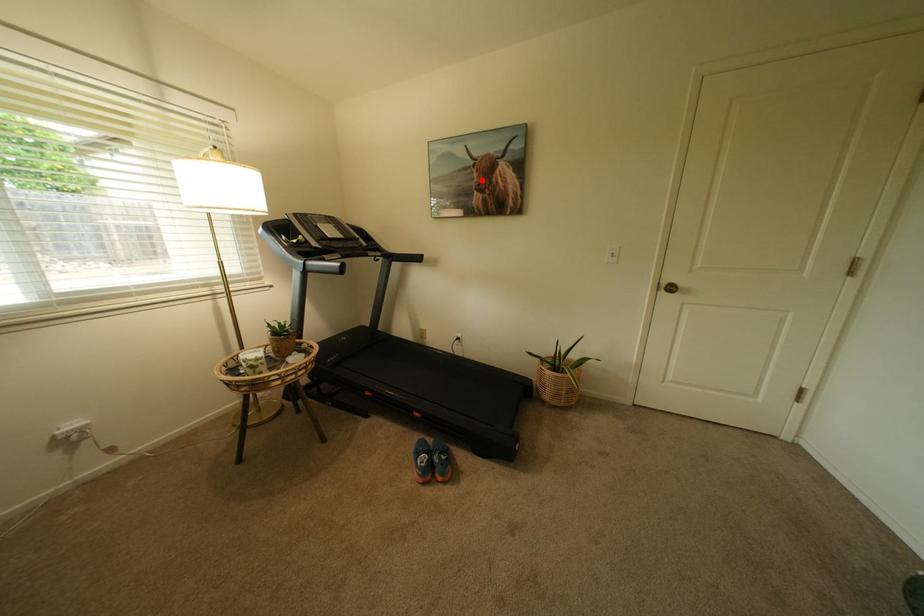
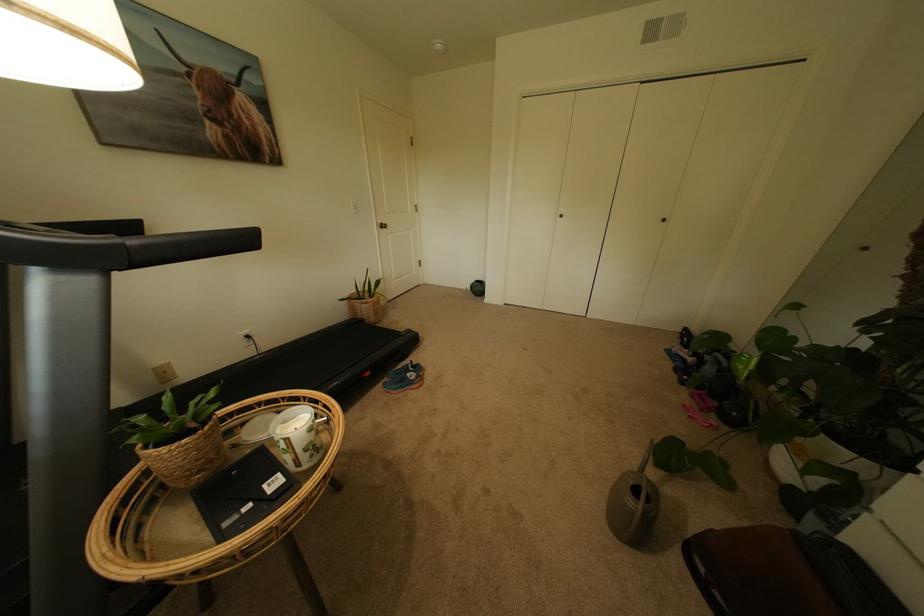
In the second image, find the point that corresponds to the highlighted location in the first image.

(204, 100)